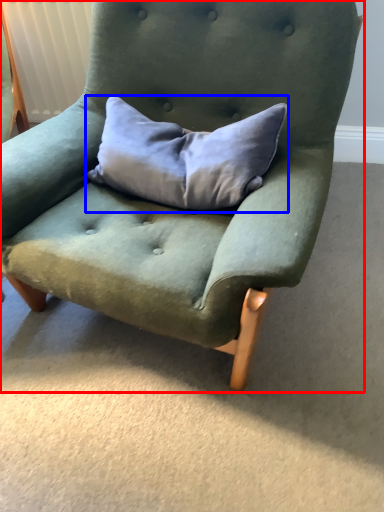
Question: Among these objects, which one is farthest to the camera, chair (highlighted by a red box) or pillow (highlighted by a blue box)?

Choices:
 (A) chair
 (B) pillow

Answer: (B)